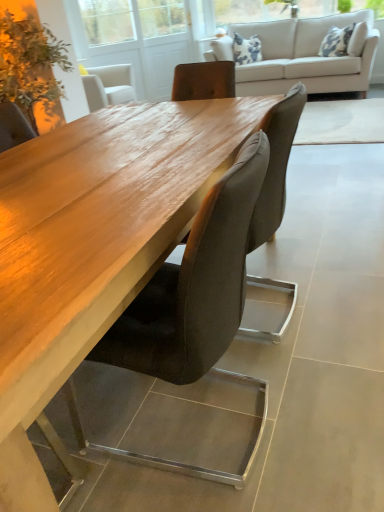
Question: Considering the relative sizes of transparent glass screen door at upper center and beige fabric couch at upper center in the image provided, is transparent glass screen door at upper center shorter than beige fabric couch at upper center?

Choices:
 (A) yes
 (B) no

Answer: (B)

Question: Is transparent glass screen door at upper center touching beige fabric couch at upper center?

Choices:
 (A) yes
 (B) no

Answer: (B)

Question: Is transparent glass screen door at upper center closer to camera compared to beige fabric couch at upper center?

Choices:
 (A) no
 (B) yes

Answer: (A)

Question: Is transparent glass screen door at upper center at the right side of beige fabric couch at upper center?

Choices:
 (A) no
 (B) yes

Answer: (A)

Question: From the image's perspective, is transparent glass screen door at upper center on beige fabric couch at upper center?

Choices:
 (A) yes
 (B) no

Answer: (A)

Question: Is transparent glass screen door at upper center to the left of beige fabric couch at upper center from the viewer's perspective?

Choices:
 (A) no
 (B) yes

Answer: (B)

Question: Does suede-like brown chair at center, arranged as the 2th chair when viewed from the back, have a lesser height compared to transparent glass screen door at upper center?

Choices:
 (A) yes
 (B) no

Answer: (A)

Question: Considering the relative sizes of suede-like brown chair at center, the first chair in the front-to-back sequence, and transparent glass screen door at upper center in the image provided, is suede-like brown chair at center, the first chair in the front-to-back sequence, taller than transparent glass screen door at upper center?

Choices:
 (A) no
 (B) yes

Answer: (A)

Question: From a real-world perspective, is suede-like brown chair at center, the first chair in the front-to-back sequence, under transparent glass screen door at upper center?

Choices:
 (A) no
 (B) yes

Answer: (B)

Question: Is transparent glass screen door at upper center located within suede-like brown chair at center, the first chair in the front-to-back sequence?

Choices:
 (A) yes
 (B) no

Answer: (B)

Question: Is suede-like brown chair at center, arranged as the 2th chair when viewed from the back, thinner than transparent glass screen door at upper center?

Choices:
 (A) yes
 (B) no

Answer: (B)

Question: Is suede-like brown chair at center, arranged as the 2th chair when viewed from the back, positioned with its back to transparent glass screen door at upper center?

Choices:
 (A) no
 (B) yes

Answer: (A)

Question: From the image's perspective, does green leafy plant at upper left appear higher than suede-like brown chair at center, marked as the first chair in a back-to-front arrangement?

Choices:
 (A) yes
 (B) no

Answer: (A)